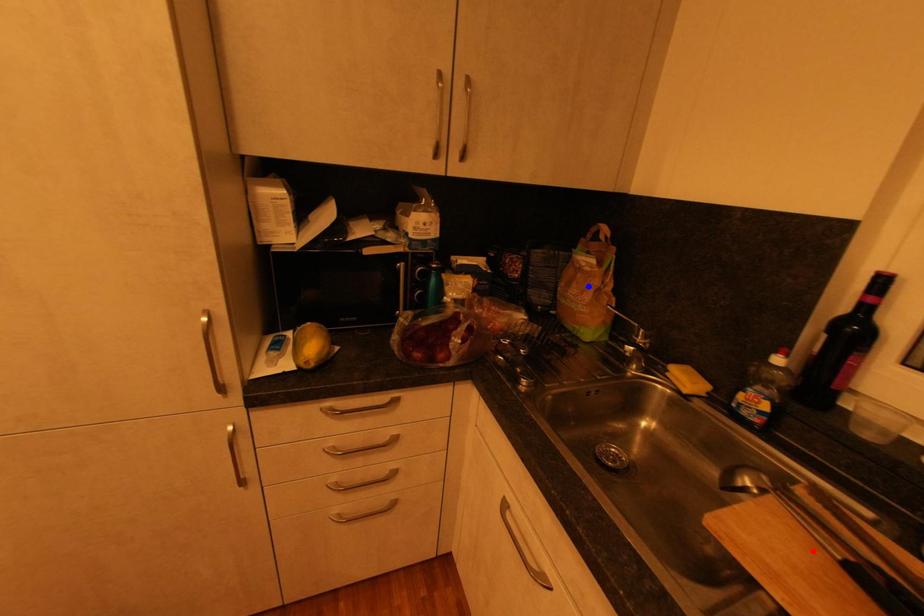
Question: In the image, two points are highlighted. Which point is nearer to the camera? Reply with the corresponding letter.

Choices:
 (A) blue point
 (B) red point

Answer: (B)